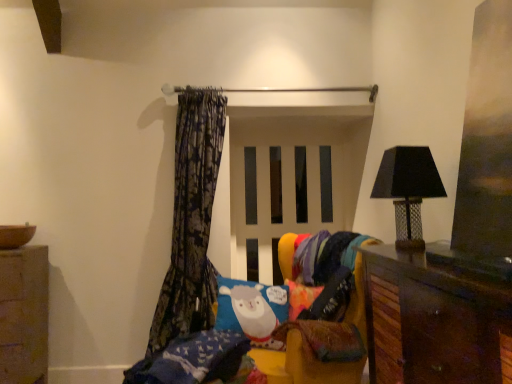
Question: In the image, is brown wooden cabinet at lower right on the left side or the right side of multicolored knitted blanket at lower right?

Choices:
 (A) right
 (B) left

Answer: (A)

Question: From a real-world perspective, is brown wooden cabinet at lower right physically located above or below multicolored knitted blanket at lower right?

Choices:
 (A) below
 (B) above

Answer: (A)

Question: Which is nearer to the multicolored knitted blanket at lower right?

Choices:
 (A) soft plush bed at center
 (B) brown wooden cabinet at lower right
 (C) smooth stone cabinet at lower left
 (D) black mesh lampshade at right
 (E) dark floral fabric curtain at left

Answer: (A)

Question: Which of these objects is positioned farthest from the dark floral fabric curtain at left?

Choices:
 (A) black mesh lampshade at right
 (B) multicolored knitted blanket at lower right
 (C) soft plush bed at center
 (D) brown wooden cabinet at lower right
 (E) smooth stone cabinet at lower left

Answer: (D)